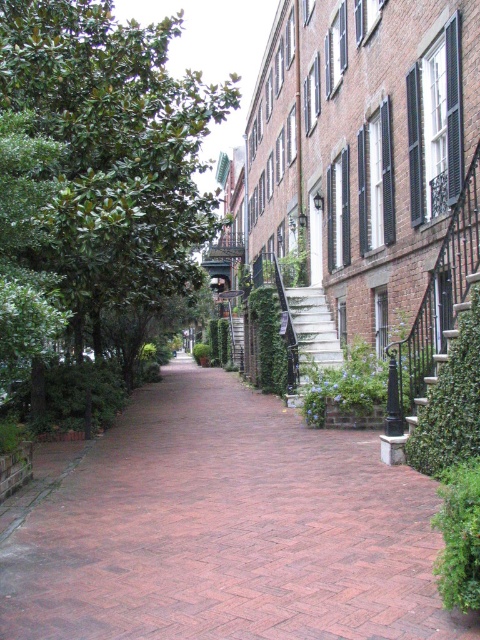
Question: Is green leafy bush at lower right positioned in front of white concrete stairs at center?

Choices:
 (A) yes
 (B) no

Answer: (A)

Question: Which point is closer to the camera?

Choices:
 (A) wooden staircase at center
 (B) green ivy bush at center

Answer: (B)

Question: Observing the image, what is the correct spatial positioning of green leafy bush at lower right in reference to green ivy bush at center?

Choices:
 (A) left
 (B) right

Answer: (B)

Question: Where is brick paved walkway at center located in relation to wooden staircase at center in the image?

Choices:
 (A) below
 (B) above

Answer: (A)

Question: Estimate the real-world distances between objects in this image. Which object is closer to the brick paved walkway at center?

Choices:
 (A) green leafy bush at lower right
 (B) green leafy tree at left

Answer: (A)

Question: Which object is the closest to the green leafy tree at left?

Choices:
 (A) wooden staircase at center
 (B) white concrete stairs at center
 (C) green leafy bush at lower right
 (D) green ivy bush at center

Answer: (D)